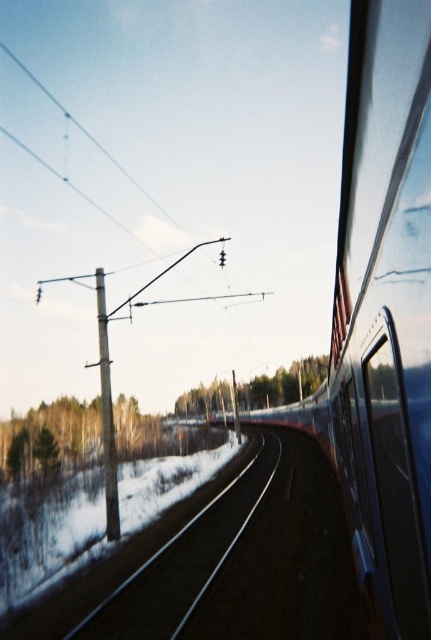
Question: From the image, what is the correct spatial relationship of green matte tree at center in relation to wooden pole at left?

Choices:
 (A) left
 (B) right

Answer: (B)

Question: Which of the following is the closest to the observer?

Choices:
 (A) (156, 589)
 (B) (53, 456)
 (C) (116, 488)
 (D) (262, 376)

Answer: (A)

Question: Which object is the closest to the wooden pole at left?

Choices:
 (A) metal/smooth track at center
 (B) green matte tree at center

Answer: (A)

Question: Which point appears closest to the camera in this image?

Choices:
 (A) [x=274, y=374]
 (B) [x=236, y=529]
 (C) [x=115, y=461]
 (D) [x=130, y=406]

Answer: (B)

Question: Does green matte tree at lower left have a smaller size compared to wooden pole at left?

Choices:
 (A) yes
 (B) no

Answer: (B)

Question: Is green matte tree at lower left above green matte tree at center?

Choices:
 (A) no
 (B) yes

Answer: (B)